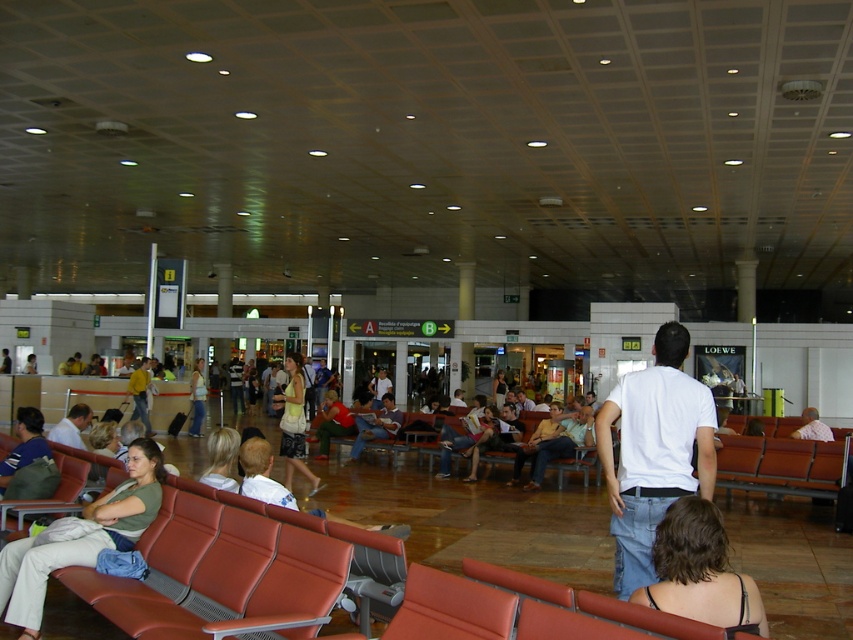
You are a passenger in the airport terminal and you see two shirts at the center area. Which shirt is closer to you, the matte white shirt at center or the yellow cotton shirt at center?

The matte white shirt at center is closer to you than the yellow cotton shirt at center.

You are a passenger in an airport terminal and you see a matte yellow dress at center and a matte white shirt at center. Which clothing item is wider?

The matte yellow dress at center is wider than the matte white shirt at center as its width surpasses the shirt.

You are standing in the airport terminal and see a matte yellow dress at center. If you want to reach the dress quickly, how many steps would you need to take?

The distance between you and the matte yellow dress at center is 31.26 feet. Assuming an average step length of about 2.5 feet, you would need approximately 12 to 13 steps to reach the matte yellow dress at center.